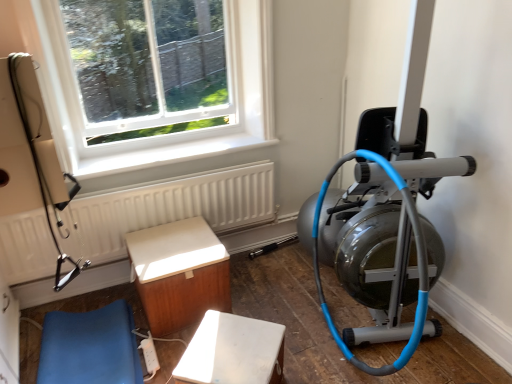
Question: Is white matte bench at lower center, marked as the 3th furniture in a left-to-right arrangement, to the left or to the right of white plastic extension cord at lower center in the image?

Choices:
 (A) right
 (B) left

Answer: (A)

Question: In terms of size, does white matte bench at lower center, the first furniture from the right, appear bigger or smaller than white plastic extension cord at lower center?

Choices:
 (A) big
 (B) small

Answer: (A)

Question: Estimate the real-world distances between objects in this image. Which object is closer to the silver metallic stationary bicycle at right?

Choices:
 (A) white plastic window at upper left
 (B) blue leather cushion at lower left, the first furniture when ordered from left to right
 (C) white plastic extension cord at lower center
 (D) wooden cabinet at lower left, acting as the 2th furniture starting from the right
 (E) white matte bench at lower center, marked as the 3th furniture in a left-to-right arrangement

Answer: (E)

Question: Which is farther from the silver metallic stationary bicycle at right?

Choices:
 (A) white plastic extension cord at lower center
 (B) white plastic window at upper left
 (C) white textured radiator at upper left
 (D) wooden cabinet at lower left, acting as the 2th furniture starting from the right
 (E) blue leather cushion at lower left, the 3th furniture when ordered from right to left

Answer: (E)